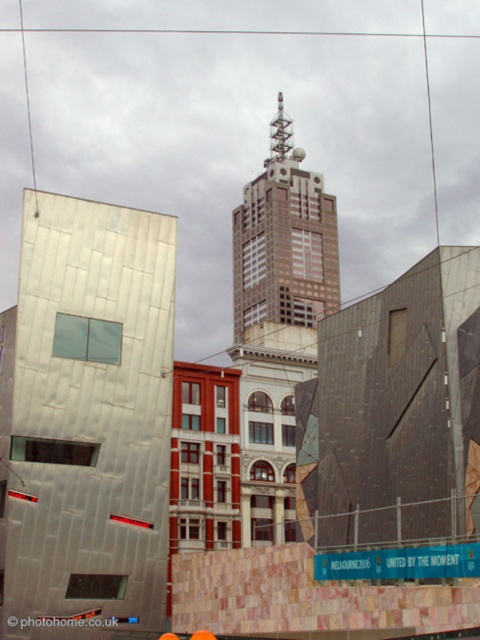
You are standing in the cityscape scene and want to walk from your current position to the point labeled as point (321, 241). There is an obstacle at point (83, 381). Will you encounter this obstacle before reaching your destination?

Yes, you will encounter the obstacle at point (83, 381) before reaching point (321, 241) because point (83, 381) is in front of point (321, 241).

You are a city planner assessing the skyline. You need to determine which of the two buildings, the metallic silver building at left or the brown glassy building at center, is shorter. Which one is shorter?

The metallic silver building at left is not as tall as the brown glassy building at center, so the metallic silver building at left is shorter.

You are an architect analyzing the cityscape. You need to determine which building is smaller in size between the metallic silver building at left and the brown glassy building at center. Which one is it?

The metallic silver building at left has a smaller size compared to the brown glassy building at center, so the metallic silver building at left is the smaller one.